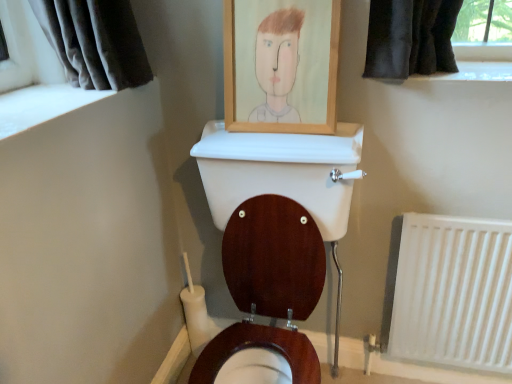
Question: Should I look upward or downward to see wooden picture frame at upper center?

Choices:
 (A) down
 (B) up

Answer: (B)

Question: Is white plastic radiator at lower right at the right side of wooden picture frame at upper center?

Choices:
 (A) no
 (B) yes

Answer: (B)

Question: From a real-world perspective, is white plastic radiator at lower right physically below wooden picture frame at upper center?

Choices:
 (A) yes
 (B) no

Answer: (A)

Question: From the image's perspective, is white plastic radiator at lower right over wooden picture frame at upper center?

Choices:
 (A) no
 (B) yes

Answer: (A)

Question: Does white plastic radiator at lower right have a greater height compared to wooden picture frame at upper center?

Choices:
 (A) yes
 (B) no

Answer: (A)

Question: Is white plastic radiator at lower right oriented towards wooden picture frame at upper center?

Choices:
 (A) no
 (B) yes

Answer: (A)

Question: From a real-world perspective, is white plastic radiator at lower right physically above wooden picture frame at upper center?

Choices:
 (A) yes
 (B) no

Answer: (B)

Question: Does wooden picture frame at upper center lie behind white plastic radiator at lower right?

Choices:
 (A) yes
 (B) no

Answer: (B)

Question: Can you confirm if wooden picture frame at upper center is wider than white plastic radiator at lower right?

Choices:
 (A) yes
 (B) no

Answer: (A)

Question: Is wooden picture frame at upper center at the right side of white plastic radiator at lower right?

Choices:
 (A) no
 (B) yes

Answer: (A)

Question: Is wooden picture frame at upper center oriented away from white plastic radiator at lower right?

Choices:
 (A) no
 (B) yes

Answer: (A)

Question: From the image's perspective, is wooden picture frame at upper center beneath white plastic radiator at lower right?

Choices:
 (A) yes
 (B) no

Answer: (B)

Question: Is wooden picture frame at upper center shorter than white plastic radiator at lower right?

Choices:
 (A) yes
 (B) no

Answer: (A)

Question: In the image, is white plastic radiator at lower right positioned in front of or behind wooden picture frame at upper center?

Choices:
 (A) front
 (B) behind

Answer: (B)